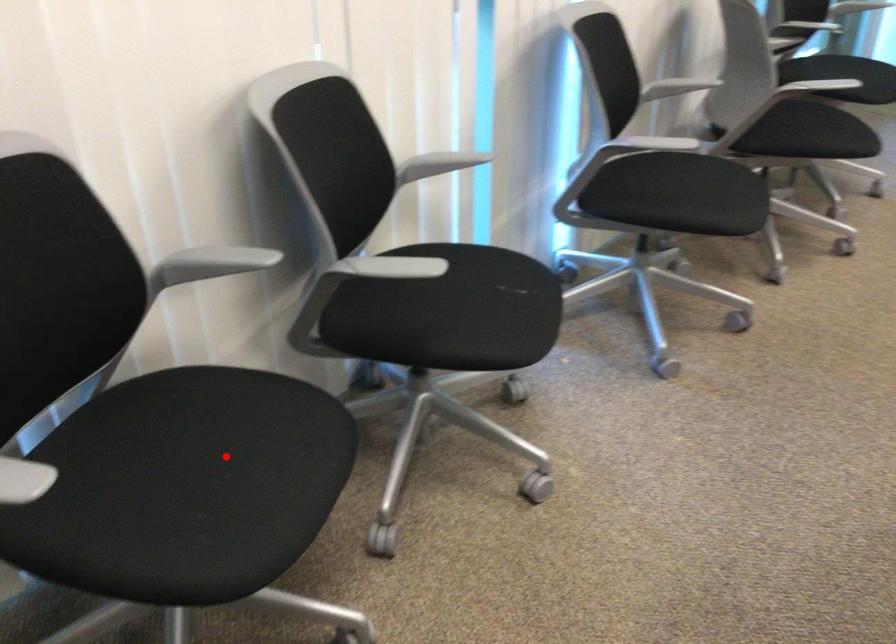
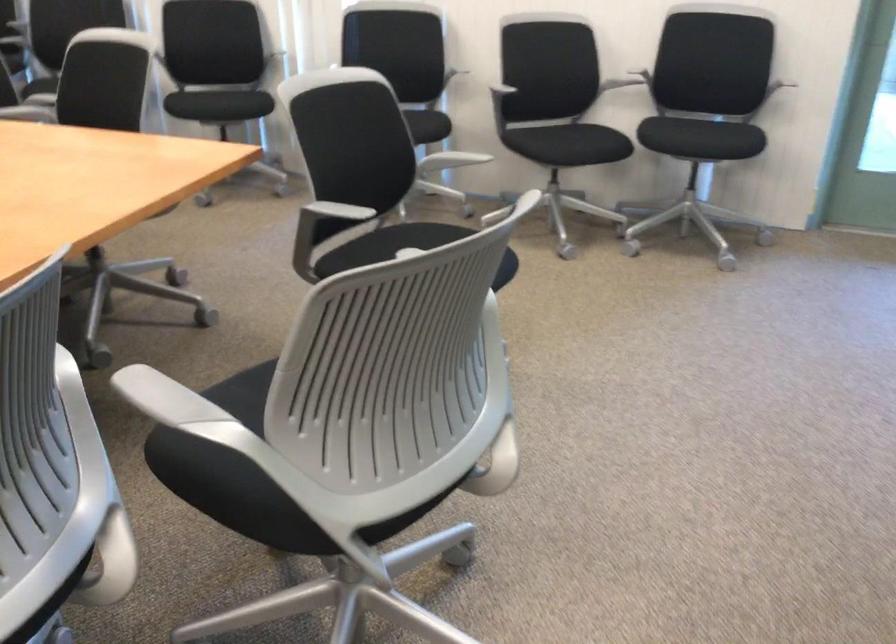
Question: I am providing you with two images of the same scene from different viewpoints. A red point is marked on the first image. Is the red point's position out of view in image 2?

Choices:
 (A) Yes
 (B) No

Answer: (A)